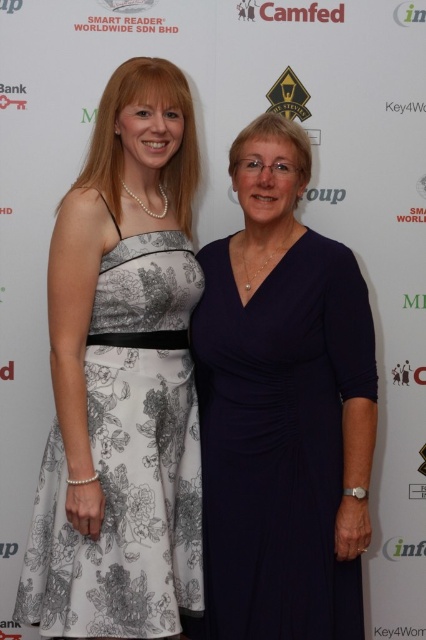
Measure the distance between point (328, 545) and camera.

5.60 feet

Is navy blue dress at center further to camera compared to white floral fabric dress at left?

Yes, navy blue dress at center is behind white floral fabric dress at left.

Find the location of a particular element. navy blue dress at center is located at coordinates (282, 410).